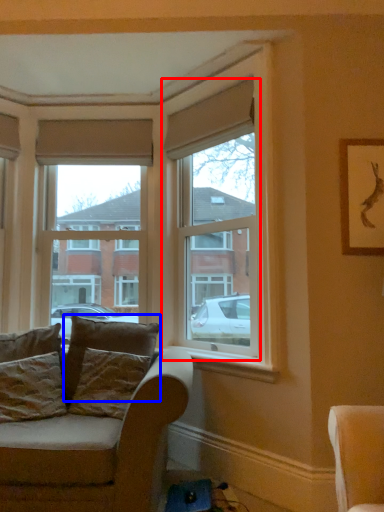
Question: Which object appears closest to the camera in this image, window (highlighted by a red box) or pillow (highlighted by a blue box)?

Choices:
 (A) window
 (B) pillow

Answer: (A)